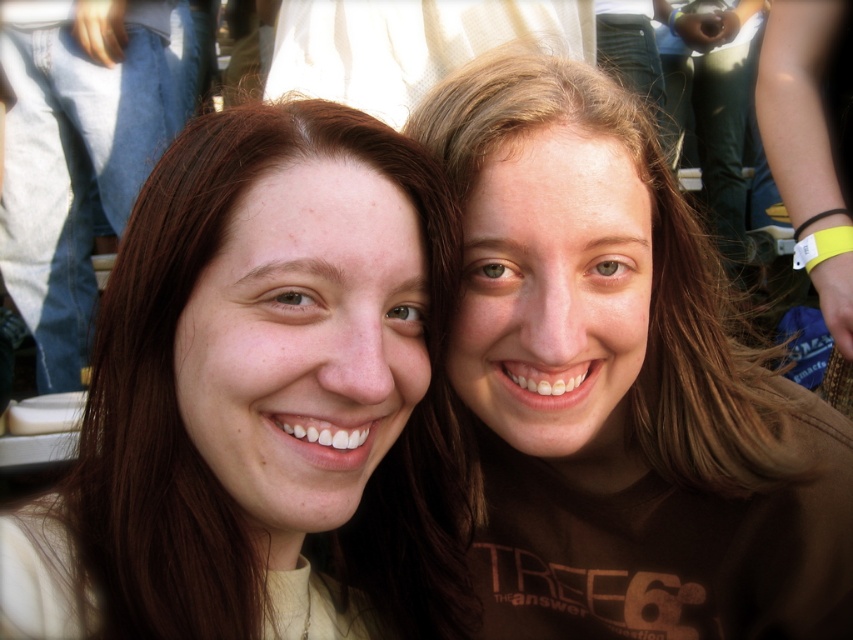
Which is more to the right, brown matte hair at upper right or matte brown hair at left?

brown matte hair at upper right is more to the right.

Does brown matte hair at upper right appear under matte brown hair at left?

Indeed, brown matte hair at upper right is positioned under matte brown hair at left.

This screenshot has width=853, height=640. Identify the location of brown matte hair at upper right. (619, 385).

The width and height of the screenshot is (853, 640). I want to click on brown matte hair at upper right, so click(619, 385).

Does matte beige hair at left have a smaller size compared to matte brown hair at left?

Yes.

Does matte beige hair at left appear on the left side of matte brown hair at left?

Incorrect, matte beige hair at left is not on the left side of matte brown hair at left.

Is point (456, 570) farther from camera compared to point (57, 278)?

That is False.

You are a GUI agent. You are given a task and a screenshot of the screen. Output one action in this format:
    pyautogui.click(x=<x>, y=<y>)
    Task: Click on the matte beige hair at left
    
    Given the screenshot: What is the action you would take?
    pyautogui.click(x=195, y=433)

This screenshot has height=640, width=853. What do you see at coordinates (619, 385) in the screenshot? I see `brown matte hair at upper right` at bounding box center [619, 385].

Can you confirm if brown matte hair at upper right is wider than matte beige hair at left?

→ Yes, brown matte hair at upper right is wider than matte beige hair at left.

Does point (674, 545) come closer to viewer compared to point (428, 582)?

No, it is behind (428, 582).

At what (x,y) coordinates should I click in order to perform the action: click on brown matte hair at upper right. Please return your answer as a coordinate pair (x, y). This screenshot has height=640, width=853. Looking at the image, I should click on (619, 385).